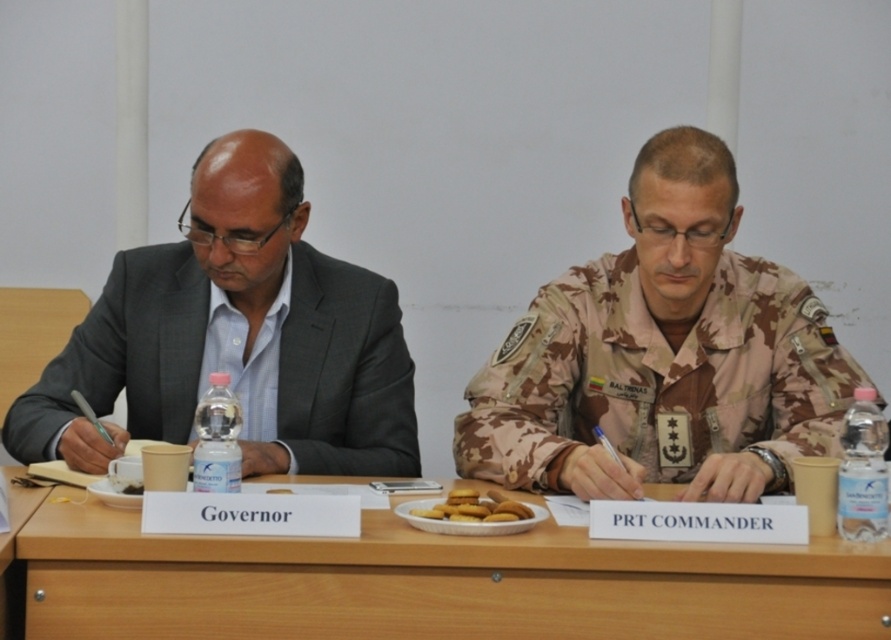
You are a photographer who needs to take a photo of the camouflage fabric uniform at center and the camera. The minimum distance required for the camera to focus properly is 2 meters. Can you capture both subjects in focus at the same time?

The camouflage fabric uniform at center and camera are 1.87 meters apart from each other, which is less than the required 2 meters for proper focus. Therefore, you cannot capture both subjects in focus simultaneously.

You are a photographer standing at the camera position. You need to place a small decorative item on the wooden table at lower left such that it is exactly 5 feet away from the camera. Is this possible?

The wooden table at lower left is 5.05 feet away from camera, so placing the item at the edge closest to the camera would make it approximately 5 feet away, which is possible.

Consider the image. You are a photographer at the meeting. You need to take a photo that includes both the camouflage fabric uniform at center and the golden matte cookies at center. Which object should you focus on first to ensure both are in frame?

The camouflage fabric uniform at center is larger than the golden matte cookies at center, so focus on the camouflage fabric uniform at center first to ensure both fit within the frame.